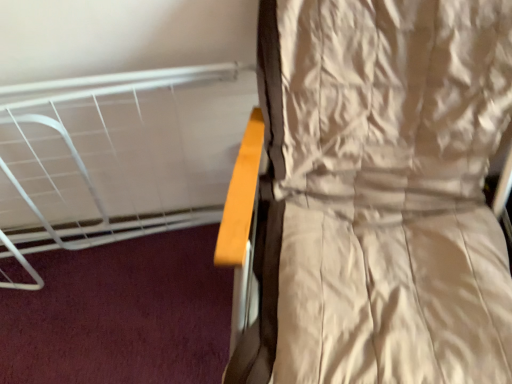
Question: Are white matte bed at upper left and beige satin curtain at right located far from each other?

Choices:
 (A) no
 (B) yes

Answer: (A)

Question: Can you see white matte bed at upper left touching beige satin curtain at right?

Choices:
 (A) no
 (B) yes

Answer: (A)

Question: Is beige satin curtain at right at the back of white matte bed at upper left?

Choices:
 (A) no
 (B) yes

Answer: (A)

Question: Is white matte bed at upper left bigger than beige satin curtain at right?

Choices:
 (A) no
 (B) yes

Answer: (A)

Question: From a real-world perspective, is white matte bed at upper left physically above beige satin curtain at right?

Choices:
 (A) no
 (B) yes

Answer: (A)

Question: Does white matte bed at upper left have a greater width compared to beige satin curtain at right?

Choices:
 (A) yes
 (B) no

Answer: (B)

Question: From the image's perspective, would you say beige satin curtain at right is shown under white matte bed at upper left?

Choices:
 (A) yes
 (B) no

Answer: (A)

Question: Could you tell me if beige satin curtain at right is turned towards white matte bed at upper left?

Choices:
 (A) yes
 (B) no

Answer: (B)

Question: Are beige satin curtain at right and white matte bed at upper left located far from each other?

Choices:
 (A) yes
 (B) no

Answer: (B)

Question: From a real-world perspective, is beige satin curtain at right physically below white matte bed at upper left?

Choices:
 (A) no
 (B) yes

Answer: (A)

Question: Is beige satin curtain at right positioned with its back to white matte bed at upper left?

Choices:
 (A) no
 (B) yes

Answer: (A)

Question: Can you confirm if beige satin curtain at right is taller than white matte bed at upper left?

Choices:
 (A) no
 (B) yes

Answer: (B)

Question: Looking at the image, does beige satin curtain at right seem bigger or smaller compared to white matte bed at upper left?

Choices:
 (A) big
 (B) small

Answer: (A)